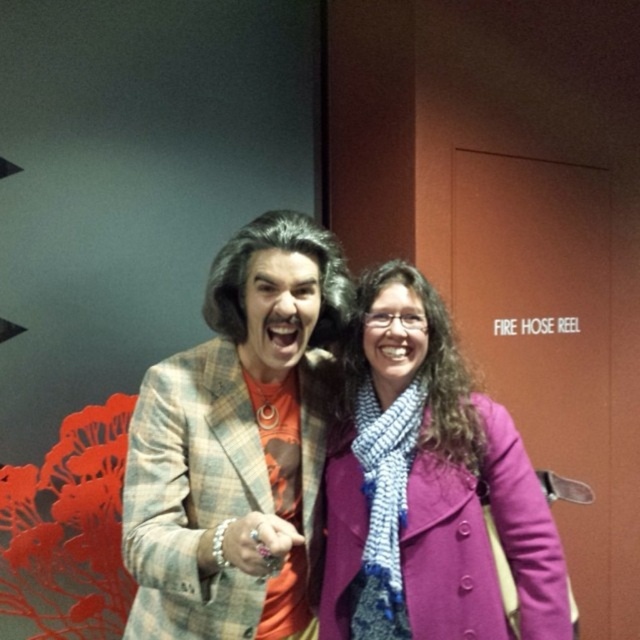
In the scene shown: Can you confirm if plaid fabric jacket at center is shorter than purple woolen coat at center?

Incorrect, plaid fabric jacket at center's height does not fall short of purple woolen coat at center's.

Which of these two, plaid fabric jacket at center or purple woolen coat at center, stands taller?

With more height is plaid fabric jacket at center.

This screenshot has height=640, width=640. Find the location of `plaid fabric jacket at center`. plaid fabric jacket at center is located at coordinates (234, 445).